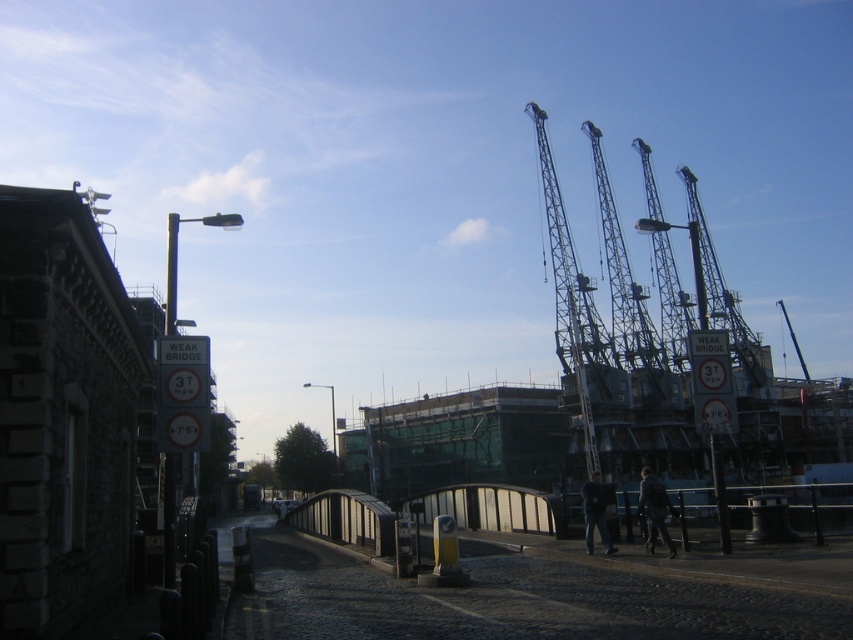
Question: Does metallic gray crane at center have a smaller size compared to metallic gray crane at upper right?

Choices:
 (A) no
 (B) yes

Answer: (A)

Question: Can you confirm if metallic gray crane at center is bigger than metallic gray crane at upper right?

Choices:
 (A) yes
 (B) no

Answer: (A)

Question: Can you confirm if metallic gray crane at center is bigger than metallic gray crane at upper right?

Choices:
 (A) no
 (B) yes

Answer: (B)

Question: Which point appears closest to the camera in this image?

Choices:
 (A) (614, 259)
 (B) (572, 282)

Answer: (B)

Question: Which point is closer to the camera taking this photo?

Choices:
 (A) (608, 216)
 (B) (581, 316)

Answer: (B)